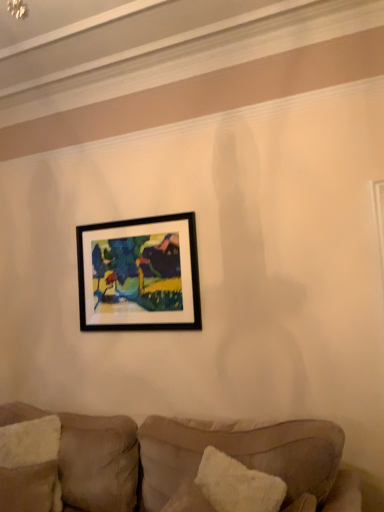
Question: Would you say white textured pillow at lower left, which is the 2th pillow from right to left, is to the left or to the right of velvet beige couch at lower center in the picture?

Choices:
 (A) left
 (B) right

Answer: (A)

Question: In terms of height, does white textured pillow at lower left, the 1th pillow positioned from the left, look taller or shorter compared to velvet beige couch at lower center?

Choices:
 (A) tall
 (B) short

Answer: (B)

Question: Based on their relative distances, which object is farther from the velvet beige couch at lower center?

Choices:
 (A) black matte picture frame at upper center
 (B) white textured pillow at lower left, which is the 2th pillow from right to left
 (C) white fluffy pillow at lower right, which appears as the 1th pillow when viewed from the right

Answer: (A)

Question: Based on their relative distances, which object is farther from the white textured pillow at lower left, the 1th pillow positioned from the left?

Choices:
 (A) black matte picture frame at upper center
 (B) velvet beige couch at lower center
 (C) white fluffy pillow at lower right, which appears as the 1th pillow when viewed from the right

Answer: (A)